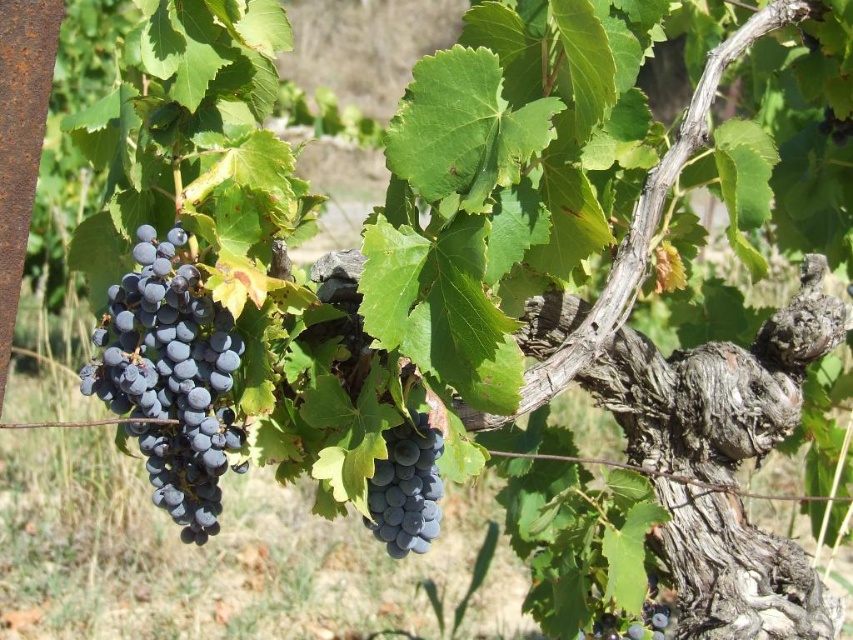
From the picture: Who is taller, shiny dark blue grapes at center or dark purple grapes at lower right?

shiny dark blue grapes at center

In the scene shown: Can you confirm if shiny dark blue grapes at center is smaller than dark purple grapes at lower right?

Incorrect, shiny dark blue grapes at center is not smaller in size than dark purple grapes at lower right.

Which is behind, point (427, 506) or point (596, 636)?

The point (596, 636) is behind.

In order to click on shiny dark blue grapes at center in this screenshot , I will do `click(405, 488)`.

Is the position of dark purple grapes at left less distant than that of shiny dark blue grapes at center?

That is True.

Can you confirm if dark purple grapes at left is positioned to the left of shiny dark blue grapes at center?

Yes, dark purple grapes at left is to the left of shiny dark blue grapes at center.

Which is behind, point (178, 440) or point (410, 493)?

The point (410, 493) is behind.

You are a GUI agent. You are given a task and a screenshot of the screen. Output one action in this format:
    pyautogui.click(x=<x>, y=<y>)
    Task: Click on the dark purple grapes at left
    This screenshot has width=853, height=640.
    Given the screenshot: What is the action you would take?
    pyautogui.click(x=170, y=378)

Can you confirm if dark purple grapes at left is positioned to the right of dark purple grapes at lower right?

In fact, dark purple grapes at left is to the left of dark purple grapes at lower right.

Can you confirm if dark purple grapes at left is positioned above dark purple grapes at lower right?

Indeed, dark purple grapes at left is positioned over dark purple grapes at lower right.

Find the location of a particular element. dark purple grapes at left is located at coordinates (170, 378).

Identify the location of dark purple grapes at left. [x=170, y=378].